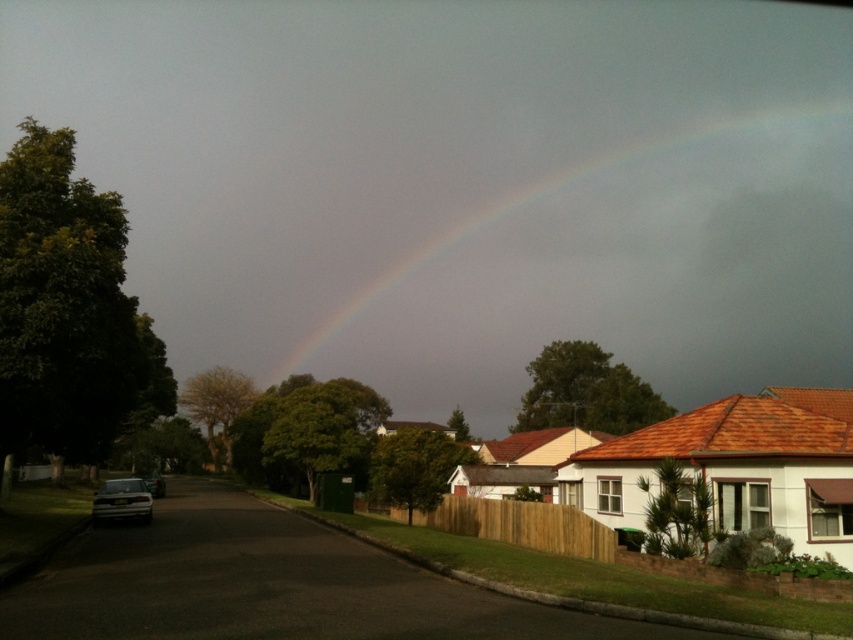
You are standing on the residential street and want to walk from the point at coordinates point (817, 360) to the point at coordinates point (144, 496). Which direction should you move to get closer to your destination?

To move from point (817, 360) to point (144, 496), you should move downward and to the right because point (144, 496) is located lower and further to the right compared to point (817, 360).

You are a delivery driver trying to park your truck between the matte silver sedan at lower left and the silver metallic car at lower left. Your truck is 25 feet long. Can you fit your truck between them?

The matte silver sedan at lower left and silver metallic car at lower left are 90.78 feet apart, so yes, the truck can fit between them since the distance between the two cars is greater than the truck length.